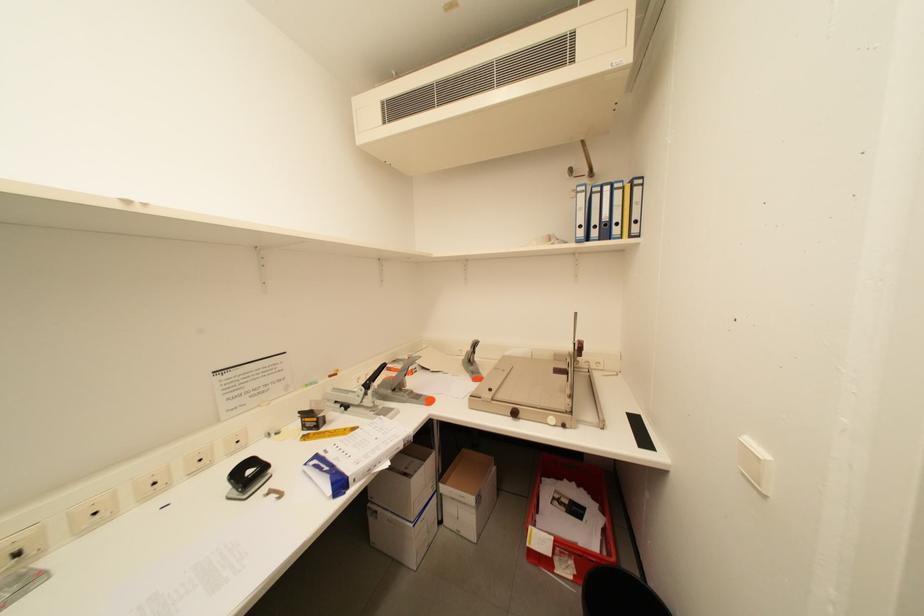
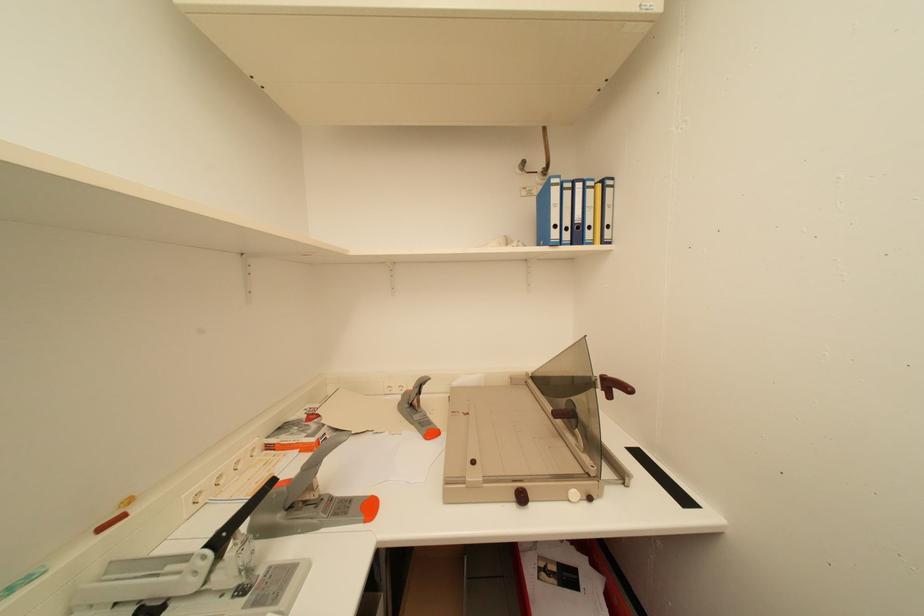
Question: The images are taken continuously from a first-person perspective. In which direction is your viewpoint rotating?

Choices:
 (A) Left
 (B) Right
 (C) Up
 (D) Down

Answer: (B)